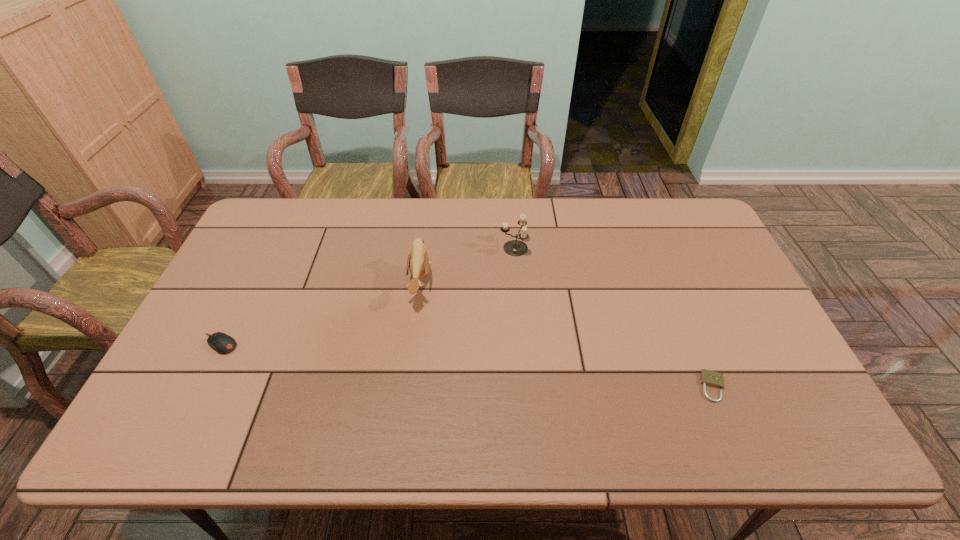
At what (x,y) coordinates should I click in order to perform the action: click on vacant area that satisfies the following two spatial constraints: 1. at the beak of the nearest object; 2. on the right side of the bird. Please return your answer as a coordinate pair (x, y). The height and width of the screenshot is (540, 960). Looking at the image, I should click on (406, 387).

What are the coordinates of `free spot that satisfies the following two spatial constraints: 1. on the back side of the rightmost object; 2. at the beak of the bird` in the screenshot? It's located at (671, 284).